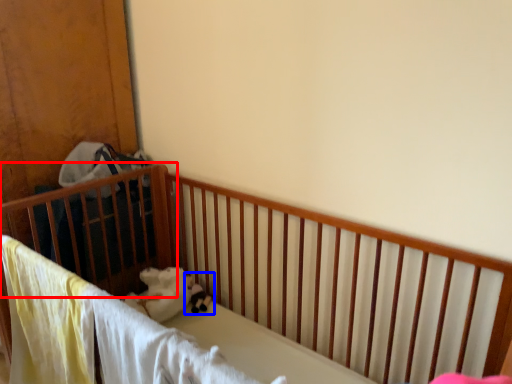
Question: Which of the following is the closest to the observer, infant bed (highlighted by a red box) or toy (highlighted by a blue box)?

Choices:
 (A) infant bed
 (B) toy

Answer: (A)